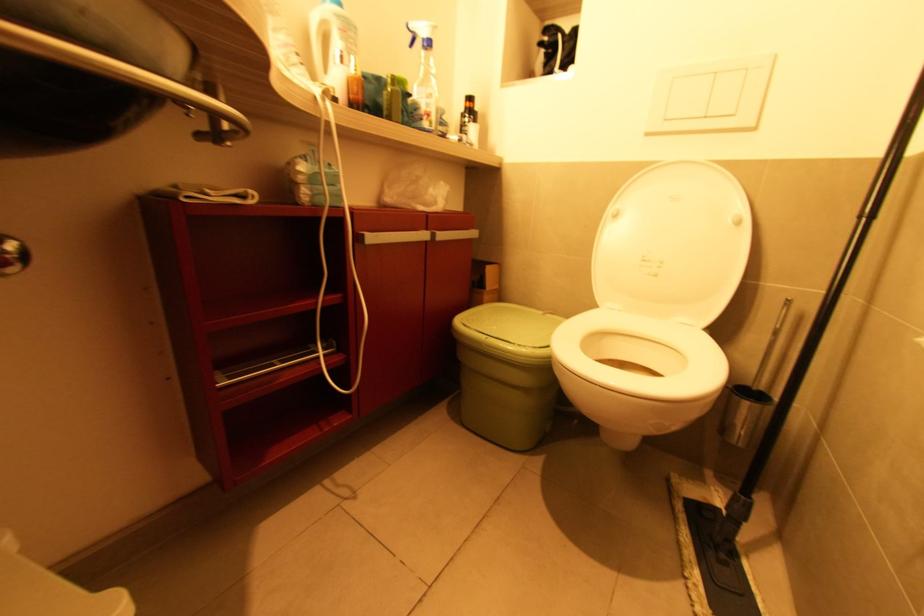
Find where to squeez the spray bottle trigger. Please return your answer as a coordinate pair (x, y).

(419, 33)